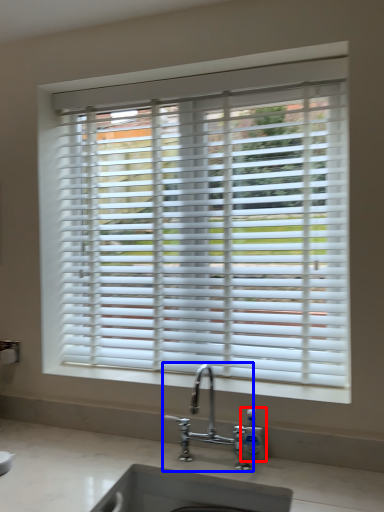
Question: Which point is further to the camera, soap dispenser (highlighted by a red box) or tap (highlighted by a blue box)?

Choices:
 (A) soap dispenser
 (B) tap

Answer: (A)